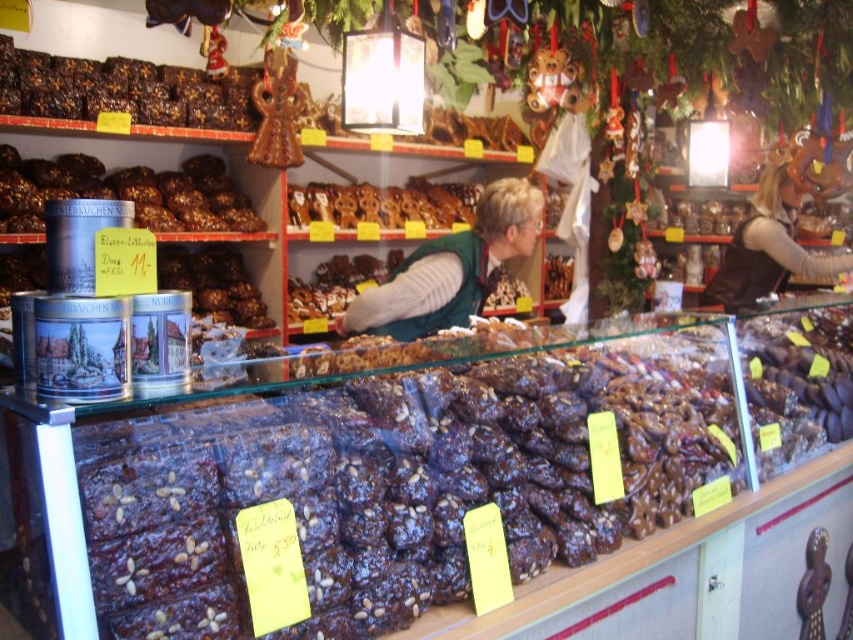
Can you confirm if dark chocolate cake at upper left is wider than brown leather vest at right?

Yes, dark chocolate cake at upper left is wider than brown leather vest at right.

Does dark chocolate cake at upper left appear on the right side of brown leather vest at right?

In fact, dark chocolate cake at upper left is to the left of brown leather vest at right.

At what (x,y) coordinates should I click in order to perform the action: click on dark chocolate cake at upper left. Please return your answer as a coordinate pair (x, y). This screenshot has height=640, width=853. Looking at the image, I should click on (x=123, y=90).

The height and width of the screenshot is (640, 853). I want to click on dark chocolate cake at upper left, so click(x=123, y=90).

Identify the location of dark chocolate cake at upper left. Image resolution: width=853 pixels, height=640 pixels. (123, 90).

Is point (73, 72) less distant than point (331, 221)?

Yes, it is in front of point (331, 221).

The image size is (853, 640). What are the coordinates of `dark chocolate cake at upper left` in the screenshot? It's located at (123, 90).

Between green fabric vest at center and brown leather vest at right, which one has less height?

Standing shorter between the two is green fabric vest at center.

What do you see at coordinates (451, 268) in the screenshot? This screenshot has height=640, width=853. I see `green fabric vest at center` at bounding box center [451, 268].

Is point (471, 305) positioned in front of point (828, 276)?

Yes, point (471, 305) is in front of point (828, 276).

Locate an element on the screen. green fabric vest at center is located at coordinates (451, 268).